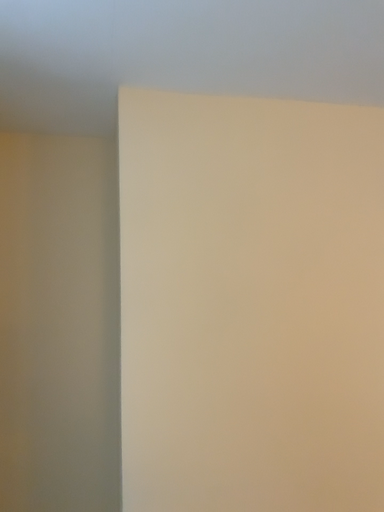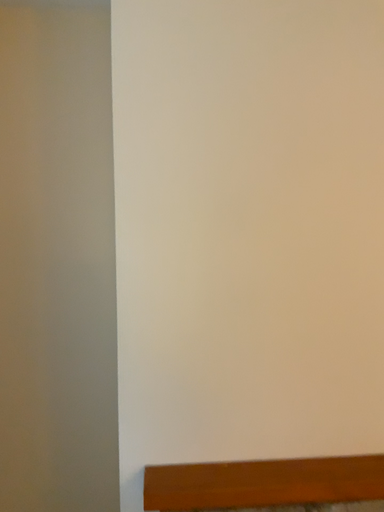
Question: How did the camera likely rotate when shooting the video?

Choices:
 (A) rotated upward
 (B) rotated downward

Answer: (B)